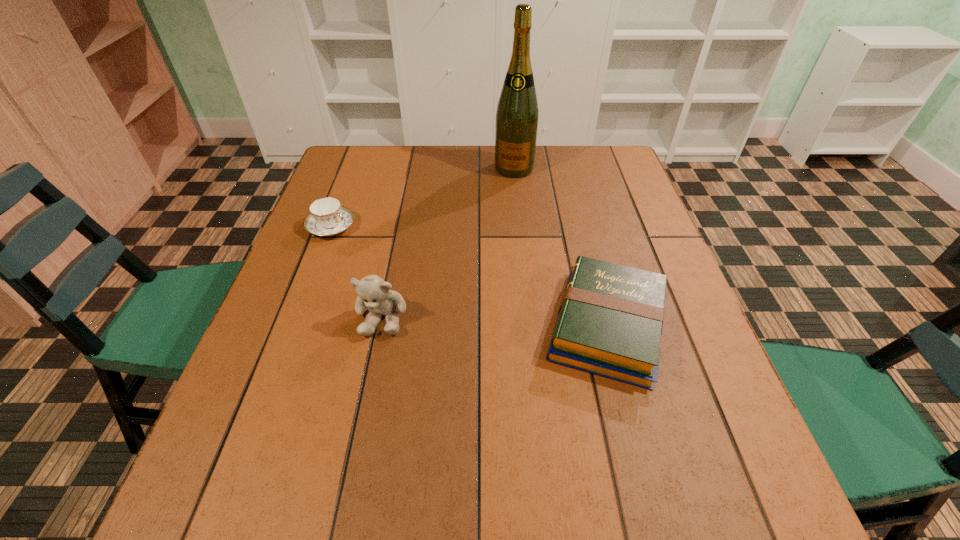
You are a GUI agent. You are given a task and a screenshot of the screen. Output one action in this format:
    pyautogui.click(x=<x>, y=<y>)
    Task: Click on the vacant area that lies between the leftmost object and the tallest object
    The height and width of the screenshot is (540, 960).
    Given the screenshot: What is the action you would take?
    pyautogui.click(x=422, y=198)

At what (x,y) coordinates should I click in order to perform the action: click on vacant area that lies between the teacup and the wine bottle. Please return your answer as a coordinate pair (x, y). This screenshot has width=960, height=540. Looking at the image, I should click on (422, 198).

Where is `free space that is in between the wine bottle and the second object from left to right`? free space that is in between the wine bottle and the second object from left to right is located at coordinates (448, 242).

You are a GUI agent. You are given a task and a screenshot of the screen. Output one action in this format:
    pyautogui.click(x=<x>, y=<y>)
    Task: Click on the blank region between the farthest object and the third nearest object
    The width and height of the screenshot is (960, 540).
    Given the screenshot: What is the action you would take?
    pyautogui.click(x=422, y=198)

The height and width of the screenshot is (540, 960). In order to click on the third closest object to the tallest object in this screenshot , I will do tap(373, 292).

The width and height of the screenshot is (960, 540). Identify the location of object that stands as the third closest to the third shortest object. (517, 115).

Find the location of a particular element. The height and width of the screenshot is (540, 960). vacant space that satisfies the following two spatial constraints: 1. on the back side of the farthest object; 2. on the left side of the teacup is located at coordinates (353, 168).

At what (x,y) coordinates should I click in order to perform the action: click on vacant area that satisfies the following two spatial constraints: 1. on the face of the teddy bear; 2. on the left side of the book. Please return your answer as a coordinate pair (x, y). Looking at the image, I should click on (380, 326).

Locate an element on the screen. The width and height of the screenshot is (960, 540). vacant space that satisfies the following two spatial constraints: 1. on the face of the book; 2. on the right side of the third object from right to left is located at coordinates (380, 326).

Where is `free space that satisfies the following two spatial constraints: 1. on the face of the book; 2. on the right side of the teddy bear`? The width and height of the screenshot is (960, 540). free space that satisfies the following two spatial constraints: 1. on the face of the book; 2. on the right side of the teddy bear is located at coordinates (380, 326).